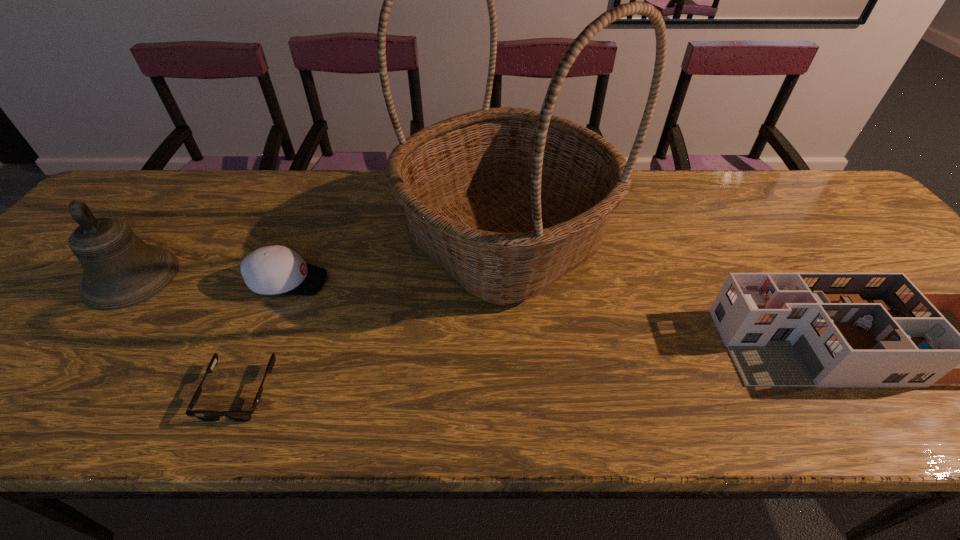
Locate an element on the screen. This screenshot has width=960, height=540. the tallest object is located at coordinates (507, 200).

Find the location of a particular element. the second object from right to left is located at coordinates (507, 200).

Locate an element on the screen. The image size is (960, 540). the leftmost object is located at coordinates (120, 270).

What are the coordinates of `bell` in the screenshot? It's located at (120, 270).

In order to click on the fourth tallest object in this screenshot , I will do `click(269, 270)`.

Identify the location of the shortest object. The image size is (960, 540). (236, 415).

You are a GUI agent. You are given a task and a screenshot of the screen. Output one action in this format:
    pyautogui.click(x=<x>, y=<y>)
    Task: Click on the vacant space situated on the left of the tallest object
    
    Given the screenshot: What is the action you would take?
    pyautogui.click(x=277, y=239)

Where is `free spot located on the back of the fourth shortest object`? free spot located on the back of the fourth shortest object is located at coordinates (186, 206).

The image size is (960, 540). What are the coordinates of `free location located on the front-facing side of the fourth tallest object` in the screenshot? It's located at (457, 282).

The width and height of the screenshot is (960, 540). Identify the location of object at the far edge. (507, 200).